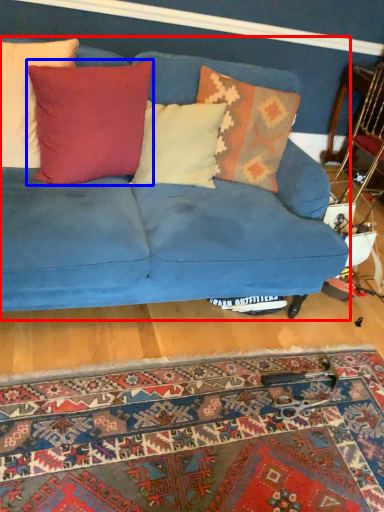
Question: Which object is closer to the camera taking this photo, studio couch (highlighted by a red box) or pillow (highlighted by a blue box)?

Choices:
 (A) studio couch
 (B) pillow

Answer: (A)